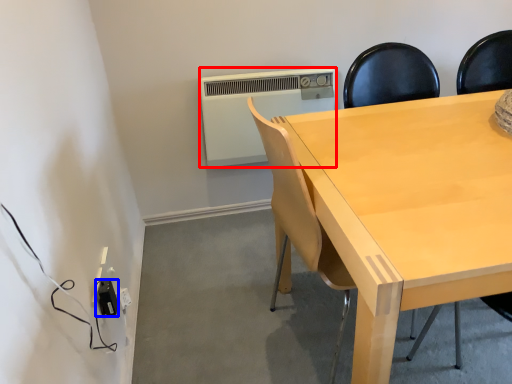
Question: Which point is further to the camera, air conditioning (highlighted by a red box) or electric outlet (highlighted by a blue box)?

Choices:
 (A) air conditioning
 (B) electric outlet

Answer: (A)